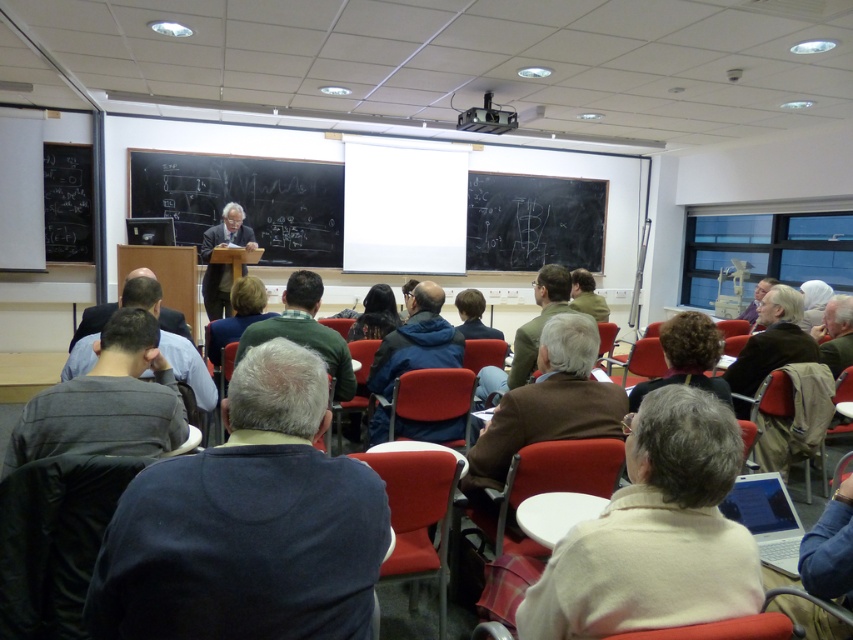
Who is shorter, beige sweater at lower right or dark gray suit at center?

Standing shorter between the two is dark gray suit at center.

Is point (693, 609) positioned in front of point (165, 321)?

Yes.

The image size is (853, 640). Identify the location of beige sweater at lower right. (654, 532).

Between beige sweater at lower right and dark brown hair at center, which one is positioned lower?

beige sweater at lower right

Where is `beige sweater at lower right`? The image size is (853, 640). beige sweater at lower right is located at coordinates (654, 532).

Identify the location of beige sweater at lower right. Image resolution: width=853 pixels, height=640 pixels. (654, 532).

Does light brown leather jacket at lower right come in front of dark gray suit at center?

No, it is behind dark gray suit at center.

Can you confirm if light brown leather jacket at lower right is wider than dark gray suit at center?

No, light brown leather jacket at lower right is not wider than dark gray suit at center.

This screenshot has width=853, height=640. In order to click on light brown leather jacket at lower right in this screenshot , I will do `click(836, 333)`.